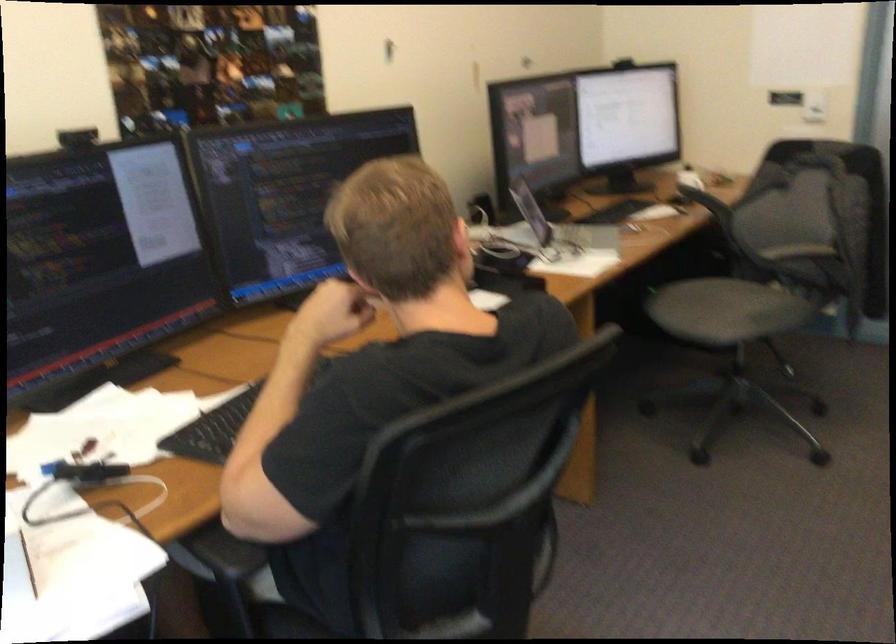
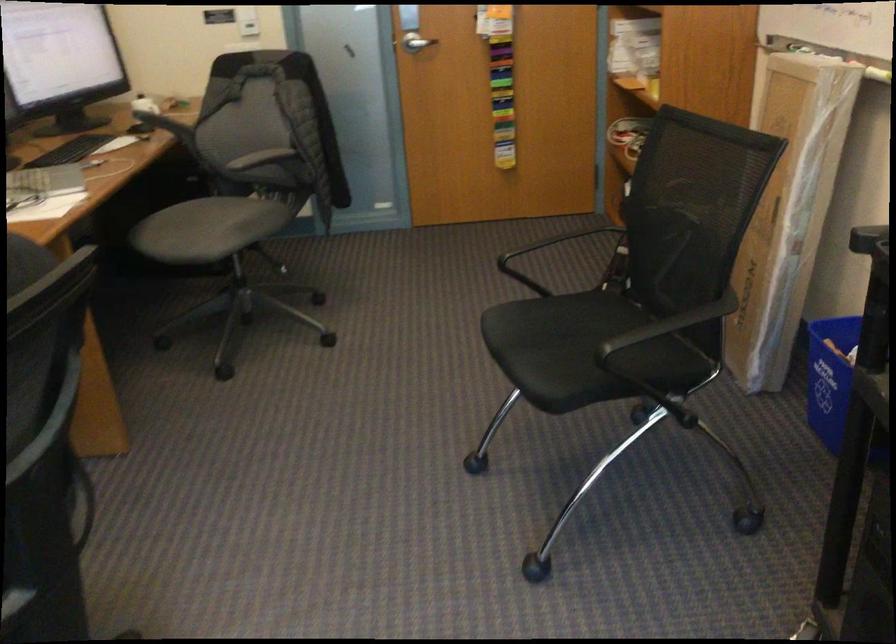
Question: How did the camera likely rotate?

Choices:
 (A) Left
 (B) Right
 (C) Up
 (D) Down

Answer: (B)